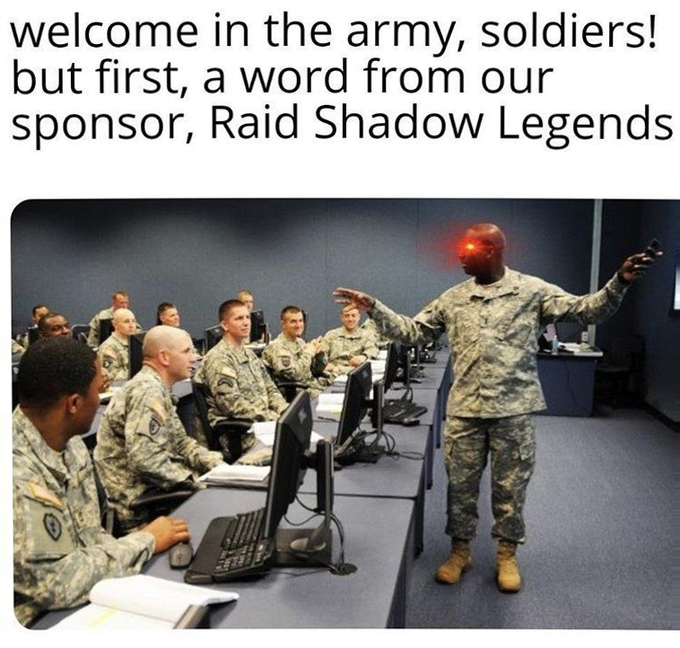
The height and width of the screenshot is (648, 680). I want to click on open books, so click(141, 614), click(239, 476), click(268, 432), click(330, 402), click(339, 378), click(379, 365).